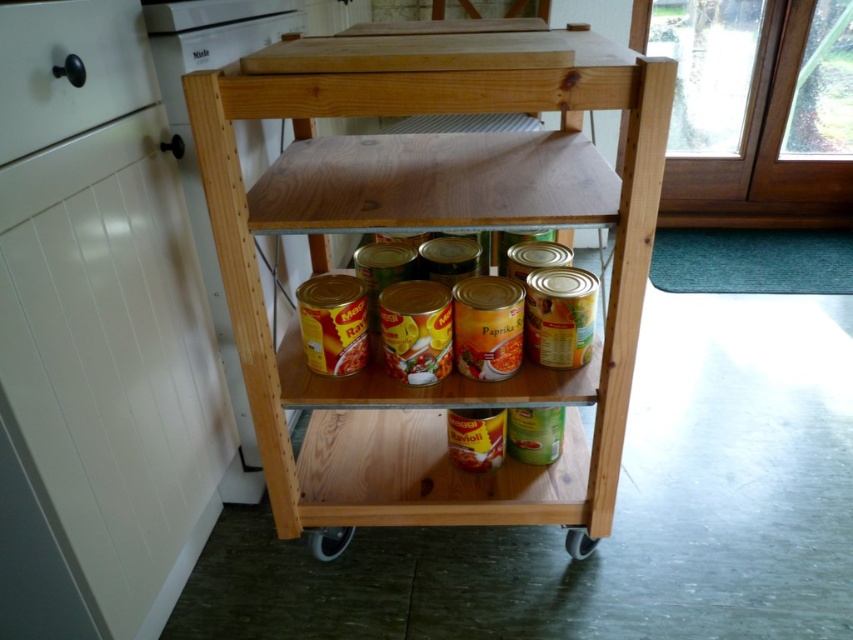
Consider the image. You are moving the wooden kitchen trolley and notice two wheels at the bottom. Which wheel, the black rubber wheel at lower center or the gray rubber wheel at lower center, is bigger?

The black rubber wheel at lower center is bigger than the gray rubber wheel at lower center.

You are trying to move the wooden kitchen trolley to the right. Which wheel will touch the floor first when you push the trolley to the right? Please choose between the black rubber wheel at lower center and the gray rubber wheel at lower center.

The black rubber wheel at lower center will touch the floor first because it is positioned to the left of the gray rubber wheel at lower center. When pushing the trolley to the right, the left side wheels would make contact first.

You are standing in the kitchen and want to reach the point at coordinates (328, 545). The camera is 1.26 meters away from that point. If you are 1.7 meters tall, will you be able to reach the point without moving closer?

The point at coordinates (328, 545) is 1.26 meters away from the camera. Since you are 1.7 meters tall, you can likely reach the point without moving closer as your height exceeds the distance required.